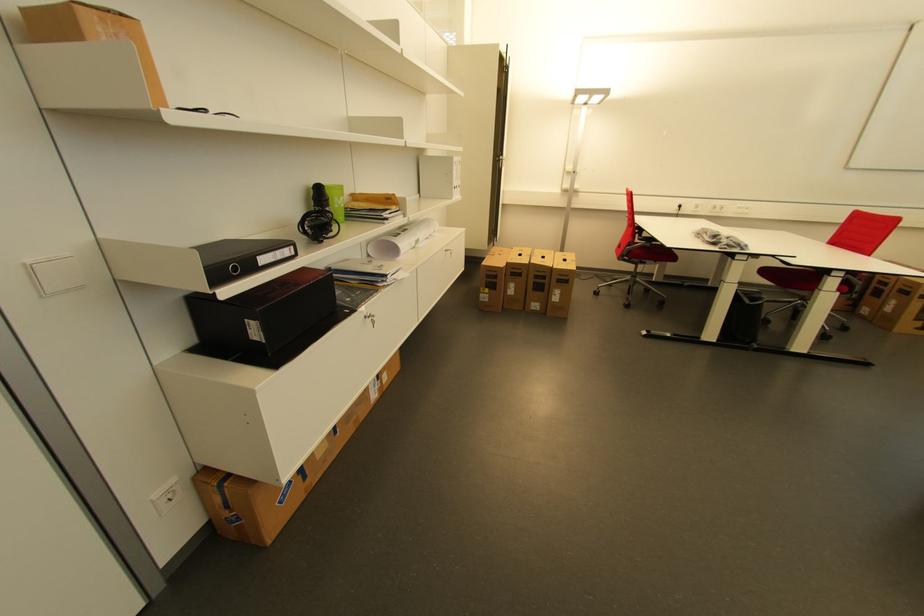
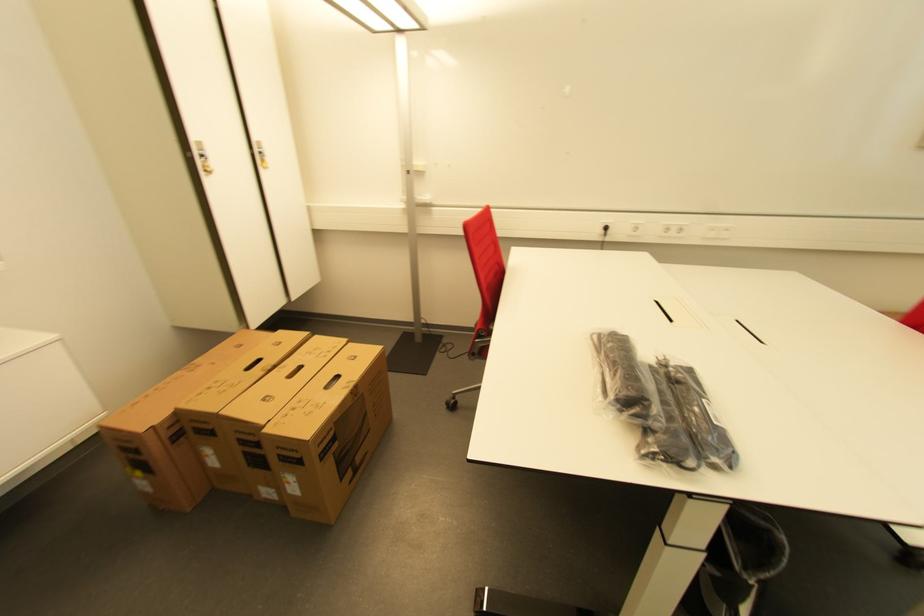
Where in the second image is the point corresponding to point 686,208 from the first image?

(611, 230)